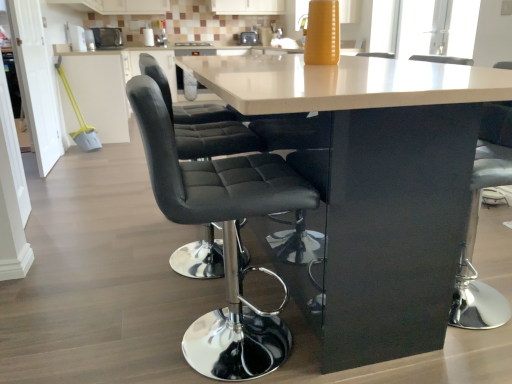
Question: Is metallic silver toaster at upper left, acting as the 2th appliance starting from the right, shorter than white glossy cabinet at upper left?

Choices:
 (A) no
 (B) yes

Answer: (B)

Question: From the image's perspective, is metallic silver toaster at upper left, the 1th appliance viewed from the left, on white glossy cabinet at upper left?

Choices:
 (A) no
 (B) yes

Answer: (B)

Question: Are metallic silver toaster at upper left, which appears as the first appliance when viewed from the front, and white glossy cabinet at upper left located far from each other?

Choices:
 (A) no
 (B) yes

Answer: (A)

Question: Is metallic silver toaster at upper left, the second appliance in the back-to-front sequence, at the left side of white glossy cabinet at upper left?

Choices:
 (A) no
 (B) yes

Answer: (B)

Question: Does metallic silver toaster at upper left, the 1th appliance viewed from the left, lie in front of white glossy cabinet at upper left?

Choices:
 (A) yes
 (B) no

Answer: (B)

Question: Is metallic silver toaster at center, arranged as the second appliance when viewed from the left, taller or shorter than black leather chair at center?

Choices:
 (A) tall
 (B) short

Answer: (B)

Question: Does point (240, 34) appear closer or farther from the camera than point (252, 347)?

Choices:
 (A) closer
 (B) farther

Answer: (B)

Question: Visually, is metallic silver toaster at center, which is the first appliance from right to left, positioned to the left or to the right of black leather chair at center?

Choices:
 (A) right
 (B) left

Answer: (B)

Question: From a real-world perspective, is metallic silver toaster at center, placed as the 2th appliance when sorted from front to back, above or below black leather chair at center?

Choices:
 (A) above
 (B) below

Answer: (A)

Question: In terms of size, does metallic silver toaster at center, which is the first appliance from right to left, appear bigger or smaller than white glossy counter at center?

Choices:
 (A) small
 (B) big

Answer: (A)

Question: In the image, is metallic silver toaster at center, which is the first appliance from right to left, positioned in front of or behind white glossy counter at center?

Choices:
 (A) front
 (B) behind

Answer: (B)

Question: From a real-world perspective, relative to white glossy counter at center, is metallic silver toaster at center, placed as the 2th appliance when sorted from front to back, vertically above or below?

Choices:
 (A) below
 (B) above

Answer: (B)

Question: Is metallic silver toaster at center, acting as the 1th appliance starting from the back, inside or outside of white glossy counter at center?

Choices:
 (A) outside
 (B) inside

Answer: (A)

Question: Relative to metallic silver toaster at center, acting as the 1th appliance starting from the back, is metallic silver toaster at upper left, the 1th appliance viewed from the left, in front or behind?

Choices:
 (A) front
 (B) behind

Answer: (A)

Question: Would you say metallic silver toaster at upper left, acting as the 2th appliance starting from the right, is inside or outside metallic silver toaster at center, acting as the 1th appliance starting from the back?

Choices:
 (A) outside
 (B) inside

Answer: (A)